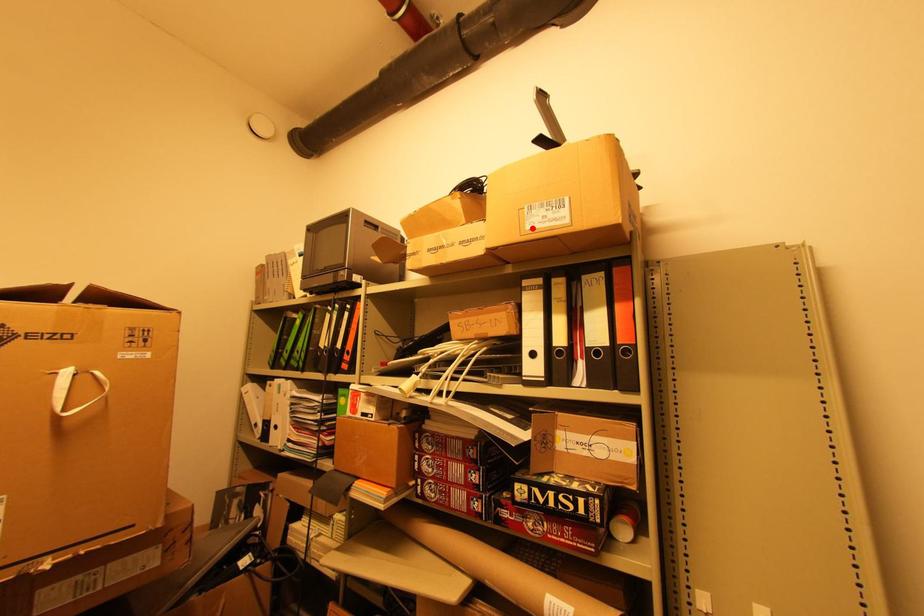
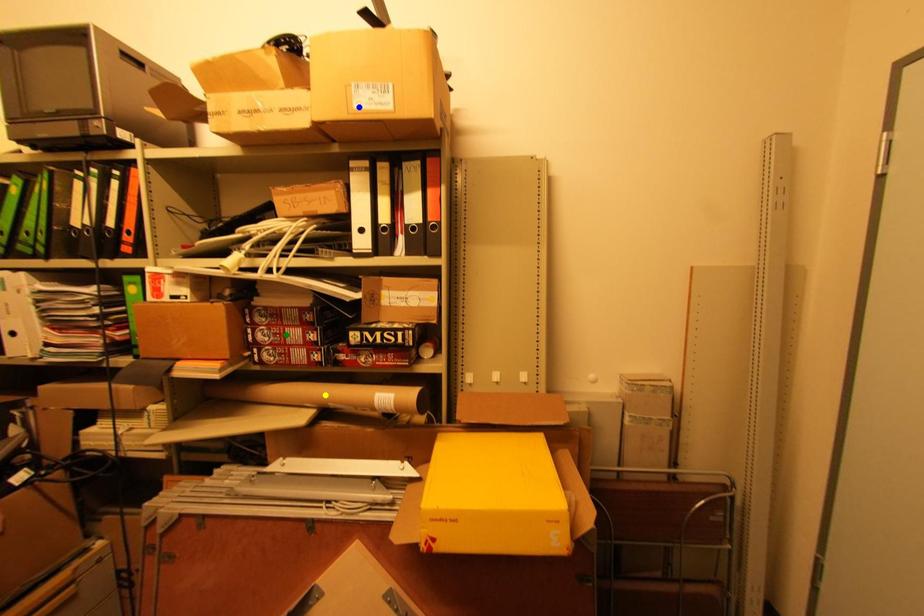
Question: I am providing you with two images of the same scene from different viewpoints. A red point is marked on the first image. You are given multiple points on the second image. Which spot in image 2 lines up with the point in image 1?

Choices:
 (A) green point
 (B) blue point
 (C) yellow point

Answer: (B)